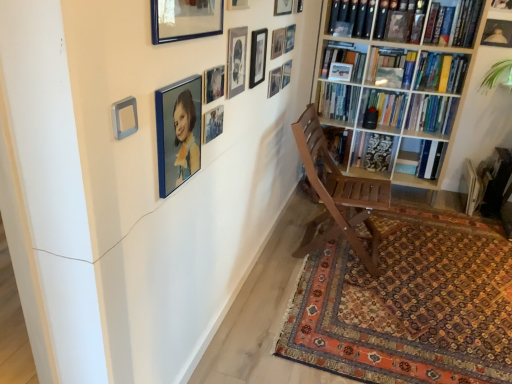
Question: Considering the relative sizes of blue glossy picture frame at upper center, acting as the 14th picture frame starting from the right, and matte black picture frame at upper center, positioned as the ninth picture frame in left-to-right order, in the image provided, is blue glossy picture frame at upper center, acting as the 14th picture frame starting from the right, wider than matte black picture frame at upper center, positioned as the ninth picture frame in left-to-right order,?

Choices:
 (A) yes
 (B) no

Answer: (A)

Question: Are blue glossy picture frame at upper center, positioned as the 1th picture frame in left-to-right order, and matte black picture frame at upper center, the 6th picture frame viewed from the right, located far from each other?

Choices:
 (A) no
 (B) yes

Answer: (A)

Question: From the image's perspective, is blue glossy picture frame at upper center, acting as the 14th picture frame starting from the right, on top of matte black picture frame at upper center, positioned as the ninth picture frame in left-to-right order?

Choices:
 (A) no
 (B) yes

Answer: (A)

Question: Can you confirm if blue glossy picture frame at upper center, positioned as the 1th picture frame in left-to-right order, is positioned to the left of matte black picture frame at upper center, positioned as the ninth picture frame in left-to-right order?

Choices:
 (A) no
 (B) yes

Answer: (B)

Question: Is blue glossy picture frame at upper center, positioned as the 1th picture frame in left-to-right order, outside matte black picture frame at upper center, the 6th picture frame viewed from the right?

Choices:
 (A) yes
 (B) no

Answer: (A)

Question: Considering the positions of point (349, 198) and point (237, 39), is point (349, 198) closer or farther from the camera than point (237, 39)?

Choices:
 (A) closer
 (B) farther

Answer: (B)

Question: From a real-world perspective, relative to matte black picture frame at upper center, the fifth picture frame positioned from the left, is wooden chair at center vertically above or below?

Choices:
 (A) below
 (B) above

Answer: (A)

Question: Considering the positions of wooden chair at center and matte black picture frame at upper center, which is the tenth picture frame in right-to-left order, in the image, is wooden chair at center taller or shorter than matte black picture frame at upper center, which is the tenth picture frame in right-to-left order,?

Choices:
 (A) tall
 (B) short

Answer: (A)

Question: In terms of size, does wooden chair at center appear bigger or smaller than matte black picture frame at upper center, the fifth picture frame positioned from the left?

Choices:
 (A) big
 (B) small

Answer: (A)

Question: Considering the positions of matte black picture frame at upper center, placed as the seventh picture frame when sorted from left to right, and blue glossy picture frame at upper center, the thirteenth picture frame from the right, in the image, is matte black picture frame at upper center, placed as the seventh picture frame when sorted from left to right, taller or shorter than blue glossy picture frame at upper center, the thirteenth picture frame from the right,?

Choices:
 (A) short
 (B) tall

Answer: (A)

Question: Would you say matte black picture frame at upper center, acting as the eighth picture frame starting from the right, is inside or outside blue glossy picture frame at upper center, the thirteenth picture frame from the right?

Choices:
 (A) inside
 (B) outside

Answer: (B)

Question: From a real-world perspective, relative to blue glossy picture frame at upper center, the thirteenth picture frame from the right, is matte black picture frame at upper center, placed as the seventh picture frame when sorted from left to right, vertically above or below?

Choices:
 (A) above
 (B) below

Answer: (B)

Question: Does point (258, 79) appear closer or farther from the camera than point (209, 18)?

Choices:
 (A) closer
 (B) farther

Answer: (B)

Question: From a real-world perspective, relative to hardcover book at upper right, arranged as the fourth book when ordered from the bottom, is metallic silver picture frame at upper center, positioned as the 3th picture frame in left-to-right order, vertically above or below?

Choices:
 (A) above
 (B) below

Answer: (B)

Question: Relative to hardcover book at upper right, arranged as the 1th book when viewed from the top, is metallic silver picture frame at upper center, positioned as the 3th picture frame in left-to-right order, in front or behind?

Choices:
 (A) front
 (B) behind

Answer: (A)